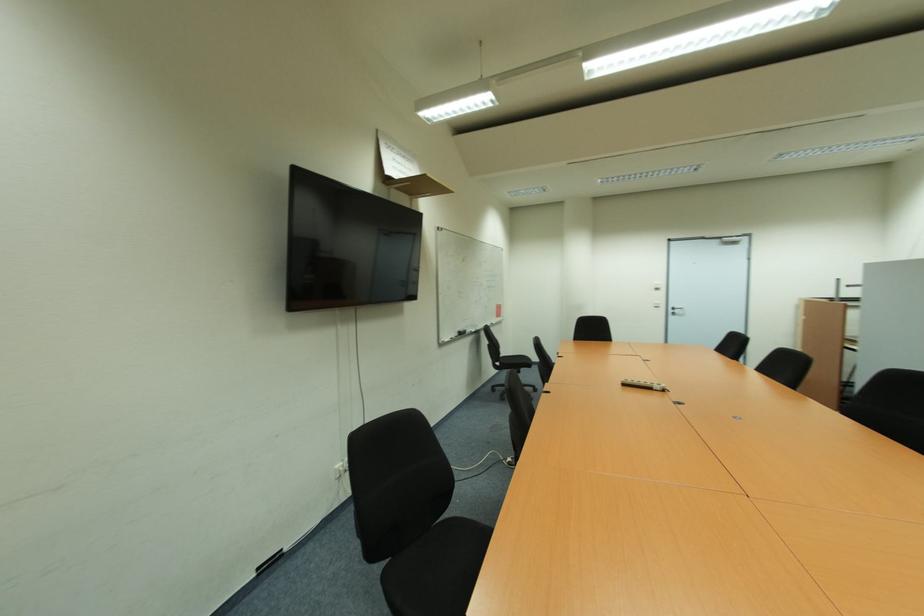
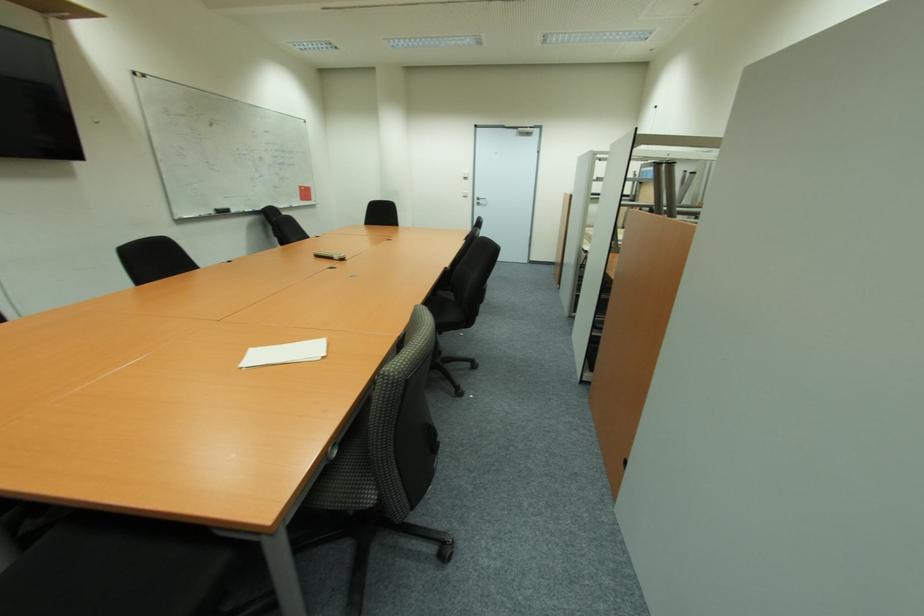
The point at (657, 290) is marked in the first image. Where is the corresponding point in the second image?

(467, 179)